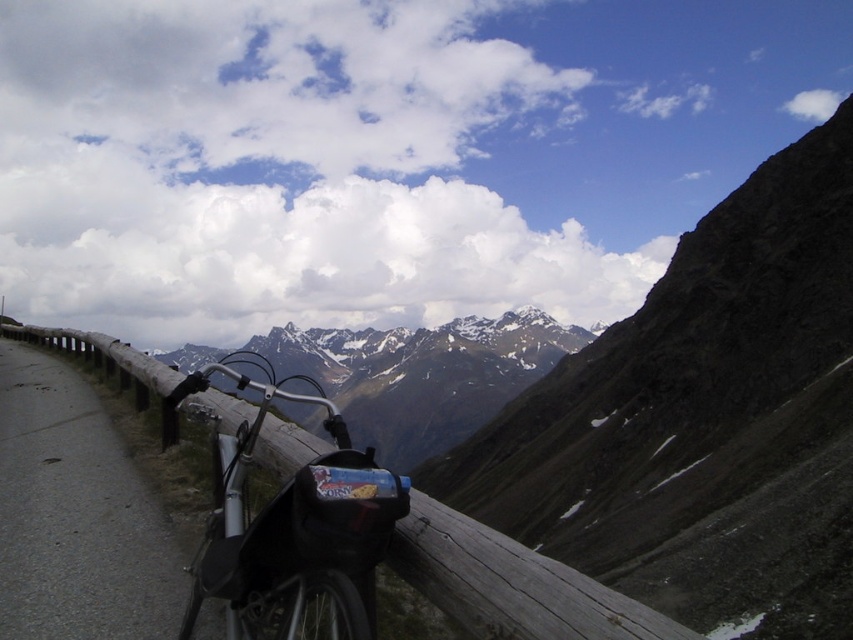
Between point (433, 440) and point (425, 518), which one is positioned behind?

Point (433, 440)

Can you confirm if snowy rocky mountain range at center is wider than wooden at left?

Yes.

Describe the element at coordinates (422, 374) in the screenshot. I see `snowy rocky mountain range at center` at that location.

At what (x,y) coordinates should I click in order to perform the action: click on snowy rocky mountain range at center. Please return your answer as a coordinate pair (x, y). The height and width of the screenshot is (640, 853). Looking at the image, I should click on (422, 374).

Can you confirm if shiny metallic bicycle at center is positioned to the right of wooden at left?

In fact, shiny metallic bicycle at center is to the left of wooden at left.

From the picture: Can you confirm if shiny metallic bicycle at center is thinner than wooden at left?

Yes.

Between point (213, 580) and point (119, 348), which one is positioned behind?

The point (119, 348) is behind.

Find the location of a particular element. This screenshot has height=640, width=853. shiny metallic bicycle at center is located at coordinates (289, 525).

Does point (128, 604) come farther from viewer compared to point (215, 461)?

No, (128, 604) is in front of (215, 461).

What do you see at coordinates (76, 515) in the screenshot? I see `gray asphalt road at lower left` at bounding box center [76, 515].

Identify the location of gray asphalt road at lower left. (76, 515).